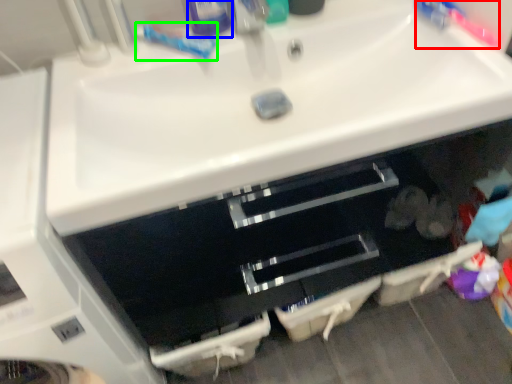
Question: Which object is the closest to the toothbrush (highlighted by a red box)? Choose among these: toiletry (highlighted by a blue box) or toothpaste (highlighted by a green box).

Choices:
 (A) toiletry
 (B) toothpaste

Answer: (A)